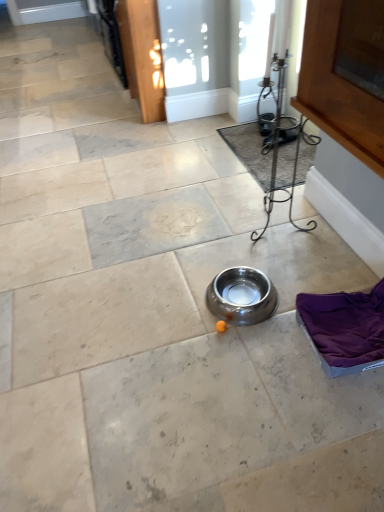
You are a GUI agent. You are given a task and a screenshot of the screen. Output one action in this format:
    pyautogui.click(x=<x>, y=<y>)
    Task: Click on the vacant space to the right of silver metallic bowl at center
    
    Given the screenshot: What is the action you would take?
    pyautogui.click(x=290, y=282)